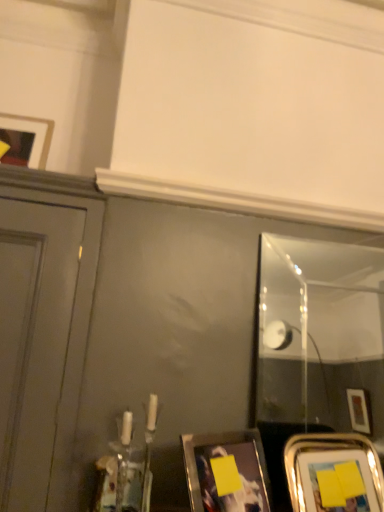
Describe the element at coordinates (45, 134) in the screenshot. The height and width of the screenshot is (512, 384). I see `matte black picture frame at upper left, which appears as the 1th picture frame when viewed from the top` at that location.

Measure the distance between point (238, 455) and camera.

Point (238, 455) is 1.05 meters away from camera.

Where is `metallic silver picture frame at lower right, arranged as the 3th picture frame when viewed from the top`? This screenshot has height=512, width=384. metallic silver picture frame at lower right, arranged as the 3th picture frame when viewed from the top is located at coordinates (333, 473).

This screenshot has height=512, width=384. What are the coordinates of `clear glass mirror at right` in the screenshot? It's located at (324, 370).

How distant is matte black picture frame at upper left, the third picture frame positioned from the right, from clear glass mirror at right?

matte black picture frame at upper left, the third picture frame positioned from the right, is 3.21 meters away from clear glass mirror at right.

How many degrees apart are the facing directions of matte black picture frame at upper left, placed as the first picture frame when sorted from left to right, and clear glass mirror at right?

The facing directions of matte black picture frame at upper left, placed as the first picture frame when sorted from left to right, and clear glass mirror at right are 3.86 degrees apart.

At what (x,y) coordinates should I click in order to perform the action: click on mirror that is in front of the matte black picture frame at upper left, the third picture frame positioned from the right. Please return your answer as a coordinate pair (x, y). Looking at the image, I should click on (324, 370).

From the image's perspective, is matte black picture frame at upper left, the third picture frame positioned from the right, located beneath clear glass mirror at right?

No, from the image's perspective, matte black picture frame at upper left, the third picture frame positioned from the right, is not beneath clear glass mirror at right.

Considering the positions of objects metallic silver picture frame at lower right, placed as the third picture frame when sorted from left to right, and yellow matte picture frame at lower center, arranged as the second picture frame when viewed from the right, in the image provided, who is more to the right, metallic silver picture frame at lower right, placed as the third picture frame when sorted from left to right, or yellow matte picture frame at lower center, arranged as the second picture frame when viewed from the right,?

Positioned to the right is metallic silver picture frame at lower right, placed as the third picture frame when sorted from left to right.

Is metallic silver picture frame at lower right, the first picture frame in the right-to-left sequence, outside of yellow matte picture frame at lower center, arranged as the second picture frame when viewed from the right?

Yes, metallic silver picture frame at lower right, the first picture frame in the right-to-left sequence, is not within yellow matte picture frame at lower center, arranged as the second picture frame when viewed from the right.

Which is closer, (355, 462) or (263, 501)?

Point (355, 462) is farther from the camera than point (263, 501).

Considering the relative sizes of metallic silver picture frame at lower right, placed as the third picture frame when sorted from left to right, and yellow matte picture frame at lower center, arranged as the second picture frame when viewed from the right, in the image provided, is metallic silver picture frame at lower right, placed as the third picture frame when sorted from left to right, shorter than yellow matte picture frame at lower center, arranged as the second picture frame when viewed from the right,?

Correct, metallic silver picture frame at lower right, placed as the third picture frame when sorted from left to right, is not as tall as yellow matte picture frame at lower center, arranged as the second picture frame when viewed from the right.

Is metallic silver picture frame at lower right, the first picture frame in the right-to-left sequence, facing towards matte black picture frame at upper left, which is the 3th picture frame from bottom to top?

No, metallic silver picture frame at lower right, the first picture frame in the right-to-left sequence, is not aimed at matte black picture frame at upper left, which is the 3th picture frame from bottom to top.

Is metallic silver picture frame at lower right, arranged as the 3th picture frame when viewed from the top, at the right side of matte black picture frame at upper left, the third picture frame positioned from the right?

Indeed, metallic silver picture frame at lower right, arranged as the 3th picture frame when viewed from the top, is positioned on the right side of matte black picture frame at upper left, the third picture frame positioned from the right.

Does metallic silver picture frame at lower right, arranged as the 3th picture frame when viewed from the top, contain matte black picture frame at upper left, placed as the first picture frame when sorted from left to right?

No, matte black picture frame at upper left, placed as the first picture frame when sorted from left to right, is not inside metallic silver picture frame at lower right, arranged as the 3th picture frame when viewed from the top.

Which object is closer to the camera, metallic silver picture frame at lower right, placed as the third picture frame when sorted from left to right, or matte black picture frame at upper left, placed as the first picture frame when sorted from left to right?

metallic silver picture frame at lower right, placed as the third picture frame when sorted from left to right.

Is metallic silver picture frame at lower right, marked as the first picture frame in a bottom-to-top arrangement, turned away from clear glass mirror at right?

Yes, metallic silver picture frame at lower right, marked as the first picture frame in a bottom-to-top arrangement, is positioned with its back facing clear glass mirror at right.

How many degrees apart are the facing directions of metallic silver picture frame at lower right, placed as the third picture frame when sorted from left to right, and clear glass mirror at right?

The angle between the facing direction of metallic silver picture frame at lower right, placed as the third picture frame when sorted from left to right, and the facing direction of clear glass mirror at right is 13.6 degrees.

Is metallic silver picture frame at lower right, the first picture frame in the right-to-left sequence, closer to camera compared to clear glass mirror at right?

That is True.

How distant is metallic silver picture frame at lower right, arranged as the 3th picture frame when viewed from the top, from clear glass mirror at right?

A distance of 8.55 feet exists between metallic silver picture frame at lower right, arranged as the 3th picture frame when viewed from the top, and clear glass mirror at right.

How different are the orientations of clear glass mirror at right and matte black picture frame at upper left, the third picture frame positioned from the right, in degrees?

3.86 degrees.

From their relative heights in the image, would you say clear glass mirror at right is taller or shorter than matte black picture frame at upper left, placed as the first picture frame when sorted from left to right?

In the image, clear glass mirror at right appears to be taller than matte black picture frame at upper left, placed as the first picture frame when sorted from left to right.

At what (x,y) coordinates should I click in order to perform the action: click on picture frame above the clear glass mirror at right (from the image's perspective). Please return your answer as a coordinate pair (x, y). This screenshot has width=384, height=512. Looking at the image, I should click on (45, 134).

Considering the positions of objects clear glass mirror at right and metallic silver picture frame at lower right, the first picture frame in the right-to-left sequence, in the image provided, who is more to the right, clear glass mirror at right or metallic silver picture frame at lower right, the first picture frame in the right-to-left sequence,?

clear glass mirror at right.

Is clear glass mirror at right positioned with its back to metallic silver picture frame at lower right, marked as the first picture frame in a bottom-to-top arrangement?

Yes, metallic silver picture frame at lower right, marked as the first picture frame in a bottom-to-top arrangement, is at the back of clear glass mirror at right.

Would you say clear glass mirror at right is a long distance from metallic silver picture frame at lower right, the first picture frame in the right-to-left sequence?

Indeed, clear glass mirror at right is not near metallic silver picture frame at lower right, the first picture frame in the right-to-left sequence.

Does point (380, 350) come closer to viewer compared to point (351, 435)?

That is False.

Considering the sizes of matte black picture frame at upper left, placed as the first picture frame when sorted from left to right, and yellow matte picture frame at lower center, positioned as the 2th picture frame in left-to-right order, in the image, is matte black picture frame at upper left, placed as the first picture frame when sorted from left to right, wider or thinner than yellow matte picture frame at lower center, positioned as the 2th picture frame in left-to-right order,?

Considering their sizes, matte black picture frame at upper left, placed as the first picture frame when sorted from left to right, looks slimmer than yellow matte picture frame at lower center, positioned as the 2th picture frame in left-to-right order.

Are matte black picture frame at upper left, which appears as the 1th picture frame when viewed from the top, and yellow matte picture frame at lower center, arranged as the second picture frame when viewed from the right, located far from each other?

matte black picture frame at upper left, which appears as the 1th picture frame when viewed from the top, is near yellow matte picture frame at lower center, arranged as the second picture frame when viewed from the right, not far away.

Is matte black picture frame at upper left, which is the 3th picture frame from bottom to top, positioned beyond the bounds of yellow matte picture frame at lower center, arranged as the second picture frame when viewed from the right?

Absolutely, matte black picture frame at upper left, which is the 3th picture frame from bottom to top, is external to yellow matte picture frame at lower center, arranged as the second picture frame when viewed from the right.

How different are the orientations of matte black picture frame at upper left, placed as the first picture frame when sorted from left to right, and yellow matte picture frame at lower center, arranged as the second picture frame when viewed from the right, in degrees?

The angle between the facing direction of matte black picture frame at upper left, placed as the first picture frame when sorted from left to right, and the facing direction of yellow matte picture frame at lower center, arranged as the second picture frame when viewed from the right, is 27.9 degrees.

Identify the location of picture frame positioned vertically above the clear glass mirror at right (from a real-world perspective). The height and width of the screenshot is (512, 384). (45, 134).

From the yellow matte picture frame at lower center, arranged as the second picture frame when viewed from the right, count 1st picture frames backward and point to it. Please provide its 2D coordinates.

[(333, 473)]

Looking at the image, which one is located further to yellow matte picture frame at lower center, placed as the second picture frame when sorted from bottom to top, metallic silver picture frame at lower right, the first picture frame in the right-to-left sequence, or matte black picture frame at upper left, the third picture frame positioned from the right?

matte black picture frame at upper left, the third picture frame positioned from the right, is further to yellow matte picture frame at lower center, placed as the second picture frame when sorted from bottom to top.

When comparing their distances from yellow matte picture frame at lower center, placed as the second picture frame when sorted from bottom to top, does metallic silver picture frame at lower right, the first picture frame in the right-to-left sequence, or clear glass mirror at right seem further?

The object further to yellow matte picture frame at lower center, placed as the second picture frame when sorted from bottom to top, is clear glass mirror at right.

Which object lies further to the anchor point metallic silver picture frame at lower right, the first picture frame in the right-to-left sequence, yellow matte picture frame at lower center, placed as the second picture frame when sorted from bottom to top, or matte black picture frame at upper left, the third picture frame positioned from the right?

matte black picture frame at upper left, the third picture frame positioned from the right, lies further to metallic silver picture frame at lower right, the first picture frame in the right-to-left sequence, than the other object.

Estimate the real-world distances between objects in this image. Which object is further from metallic silver picture frame at lower right, the first picture frame in the right-to-left sequence, matte black picture frame at upper left, which is the 3th picture frame from bottom to top, or clear glass mirror at right?

The object further to metallic silver picture frame at lower right, the first picture frame in the right-to-left sequence, is clear glass mirror at right.

Which object lies nearer to the anchor point clear glass mirror at right, metallic silver picture frame at lower right, placed as the third picture frame when sorted from left to right, or matte black picture frame at upper left, which is the 3th picture frame from bottom to top?

metallic silver picture frame at lower right, placed as the third picture frame when sorted from left to right, is positioned closer to the anchor clear glass mirror at right.

Estimate the real-world distances between objects in this image. Which object is closer to clear glass mirror at right, matte black picture frame at upper left, the third picture frame positioned from the right, or metallic silver picture frame at lower right, the first picture frame in the right-to-left sequence?

metallic silver picture frame at lower right, the first picture frame in the right-to-left sequence, is closer to clear glass mirror at right.

Looking at the image, which one is located closer to metallic silver picture frame at lower right, placed as the third picture frame when sorted from left to right, clear glass mirror at right or matte black picture frame at upper left, the third picture frame positioned from the right?

Among the two, matte black picture frame at upper left, the third picture frame positioned from the right, is located nearer to metallic silver picture frame at lower right, placed as the third picture frame when sorted from left to right.

Which object lies nearer to the anchor point metallic silver picture frame at lower right, marked as the first picture frame in a bottom-to-top arrangement, yellow matte picture frame at lower center, positioned as the second picture frame in top-to-bottom order, or clear glass mirror at right?

Among the two, yellow matte picture frame at lower center, positioned as the second picture frame in top-to-bottom order, is located nearer to metallic silver picture frame at lower right, marked as the first picture frame in a bottom-to-top arrangement.

Image resolution: width=384 pixels, height=512 pixels. In order to click on picture frame between yellow matte picture frame at lower center, placed as the second picture frame when sorted from bottom to top, and clear glass mirror at right in this screenshot , I will do `click(333, 473)`.

At what (x,y) coordinates should I click in order to perform the action: click on picture frame that lies between matte black picture frame at upper left, which appears as the 1th picture frame when viewed from the top, and metallic silver picture frame at lower right, the first picture frame in the right-to-left sequence, from top to bottom. Please return your answer as a coordinate pair (x, y). Looking at the image, I should click on (226, 472).